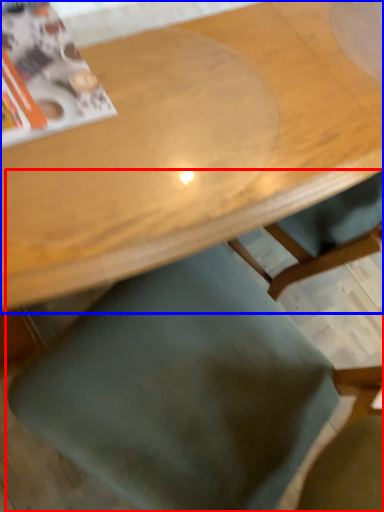
Question: Which point is closer to the camera, chair (highlighted by a red box) or table (highlighted by a blue box)?

Choices:
 (A) chair
 (B) table

Answer: (A)